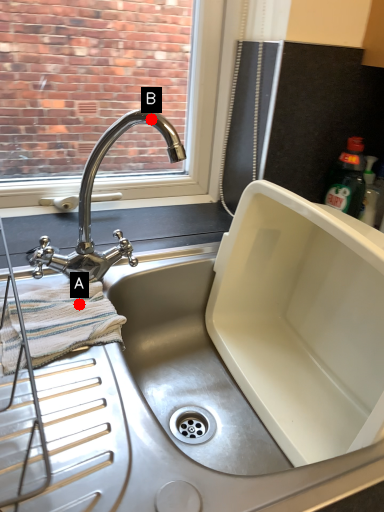
Question: Two points are circled on the image, labeled by A and B beside each circle. Which point is closer to the camera?

Choices:
 (A) A is closer
 (B) B is closer

Answer: (A)